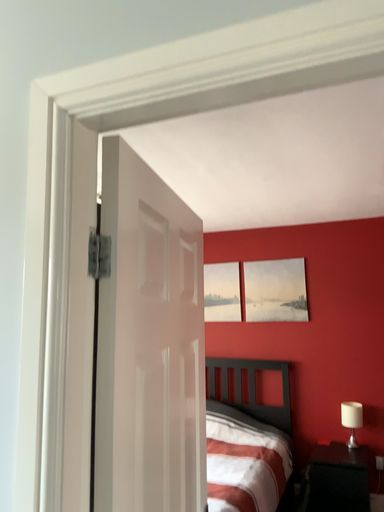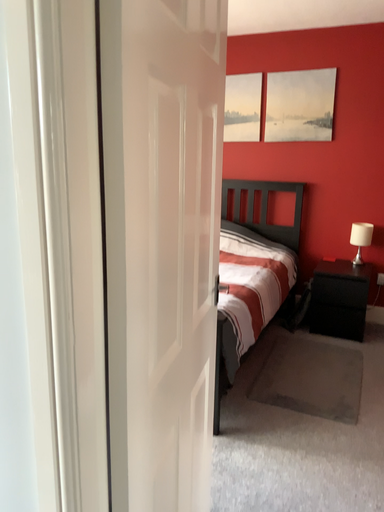
Question: How did the camera likely rotate when shooting the video?

Choices:
 (A) rotated upward
 (B) rotated downward

Answer: (B)